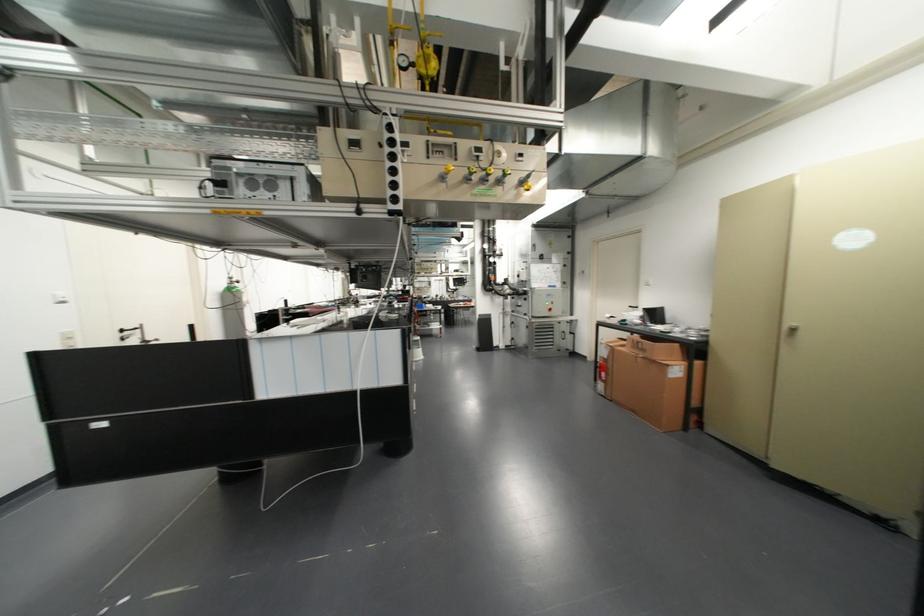
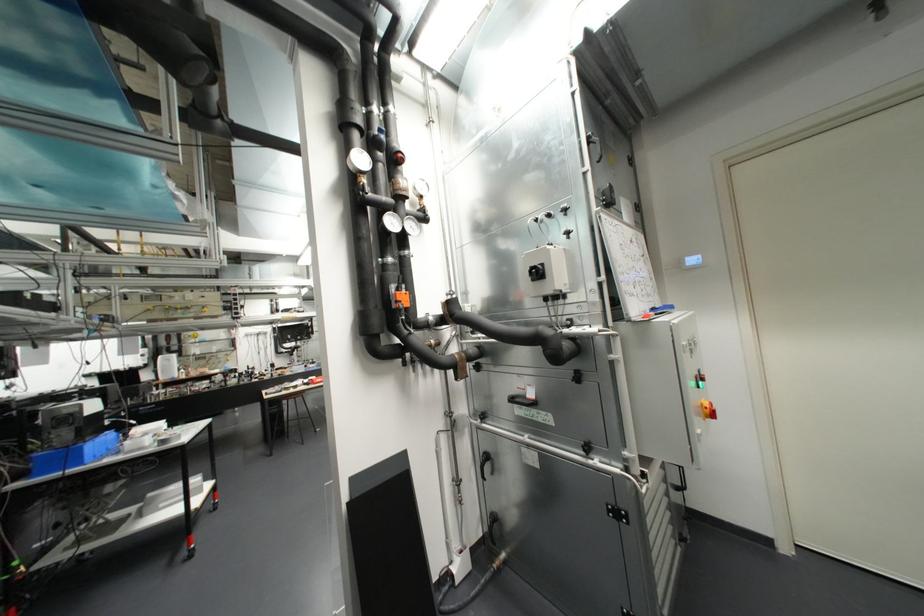
Locate, in the second image, the point that corresponds to pixel 548 286 in the first image.

(651, 309)